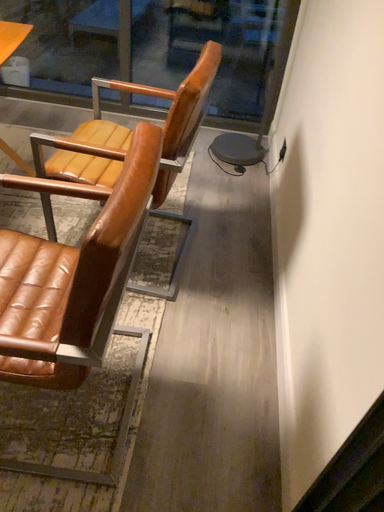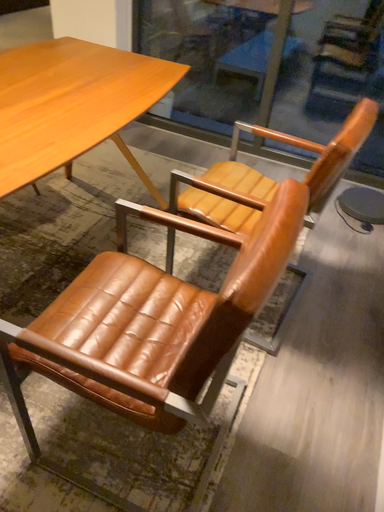
Question: How did the camera likely rotate when shooting the video?

Choices:
 (A) rotated left
 (B) rotated right

Answer: (A)